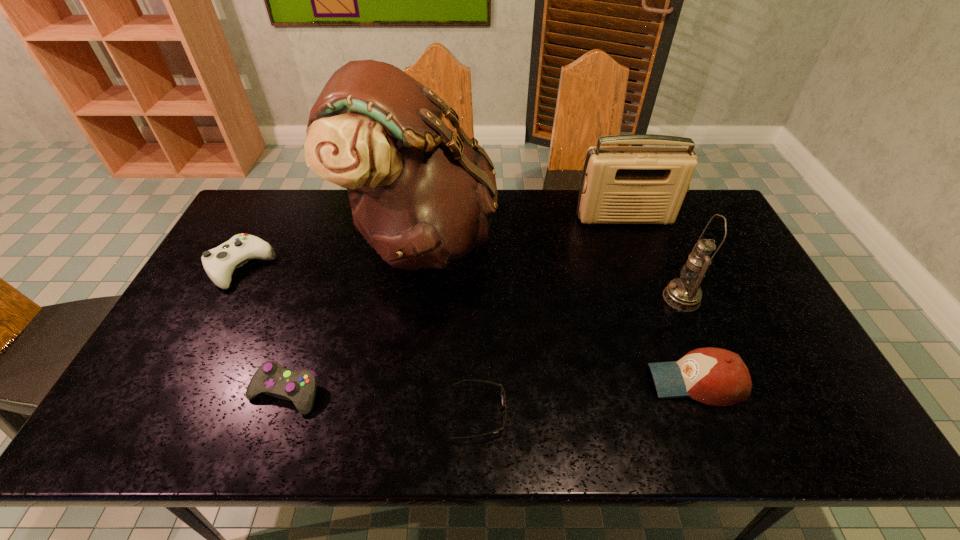
This screenshot has width=960, height=540. In order to click on satchel in this screenshot , I will do `click(422, 196)`.

Locate an element on the screen. radio receiver is located at coordinates (620, 184).

Locate an element on the screen. This screenshot has width=960, height=540. oil lamp is located at coordinates (684, 293).

This screenshot has height=540, width=960. In order to click on the fourth shortest object in this screenshot , I will do `click(714, 376)`.

The height and width of the screenshot is (540, 960). In order to click on the leftmost object in this screenshot , I will do `click(219, 263)`.

The width and height of the screenshot is (960, 540). Find the location of `the left control`. the left control is located at coordinates (219, 263).

This screenshot has width=960, height=540. I want to click on the shorter control, so click(272, 379).

Identify the location of the nearer control. (272, 379).

You are a GUI agent. You are given a task and a screenshot of the screen. Output one action in this format:
    pyautogui.click(x=<x>, y=<y>)
    Task: Click on the shortest object
    This screenshot has width=960, height=540.
    Given the screenshot: What is the action you would take?
    pyautogui.click(x=503, y=398)

Locate an element on the screen. The image size is (960, 540). vacant space located 0.260m at the front of the satchel with buckles is located at coordinates (575, 238).